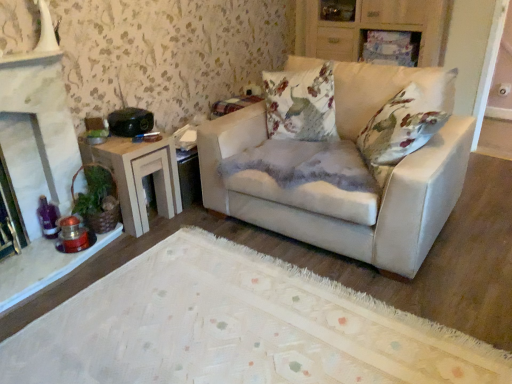
Question: Considering their positions, is wooden side table at left located in front of or behind white stone fireplace at left?

Choices:
 (A) front
 (B) behind

Answer: (B)

Question: From a real-world perspective, is wooden side table at left above or below white stone fireplace at left?

Choices:
 (A) below
 (B) above

Answer: (A)

Question: Which object is the closest to the white stone fireplace at left?

Choices:
 (A) wooden cabinet at upper center
 (B) matte white couch at center
 (C) wooden side table at left

Answer: (C)

Question: Which of these objects is positioned farthest from the matte white couch at center?

Choices:
 (A) wooden side table at left
 (B) white stone fireplace at left
 (C) wooden cabinet at upper center

Answer: (C)